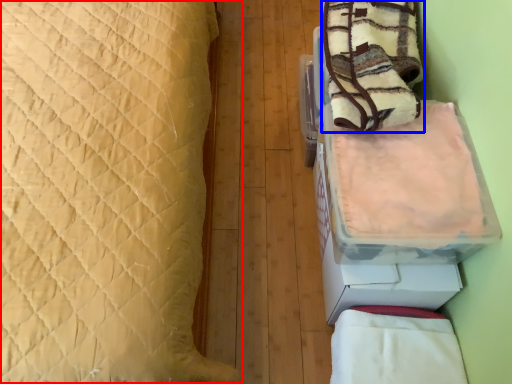
Question: Which point is closer to the camera, bed (highlighted by a red box) or blanket (highlighted by a blue box)?

Choices:
 (A) bed
 (B) blanket

Answer: (A)